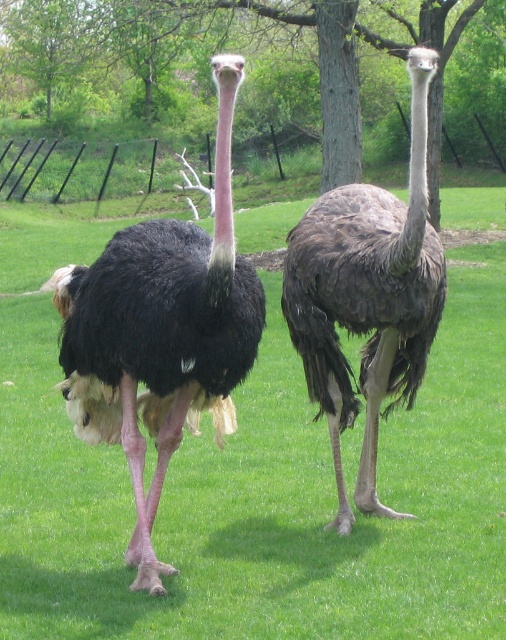
Question: Considering the real-world distances, which object is farthest from the green grass at center?

Choices:
 (A) black feathered ostrich at center
 (B) dark brown feathers at center

Answer: (A)

Question: Which of the following is the farthest from the observer?

Choices:
 (A) dark brown feathers at center
 (B) black feathered ostrich at center
 (C) green grass at center

Answer: (A)

Question: Can you confirm if black feathered ostrich at center is thinner than dark brown feathers at center?

Choices:
 (A) no
 (B) yes

Answer: (B)

Question: Is green grass at center positioned behind black feathered ostrich at center?

Choices:
 (A) yes
 (B) no

Answer: (A)

Question: Can you confirm if green grass at center is bigger than dark brown feathers at center?

Choices:
 (A) no
 (B) yes

Answer: (B)

Question: Among these points, which one is nearest to the camera?

Choices:
 (A) (242, 518)
 (B) (412, 248)

Answer: (B)